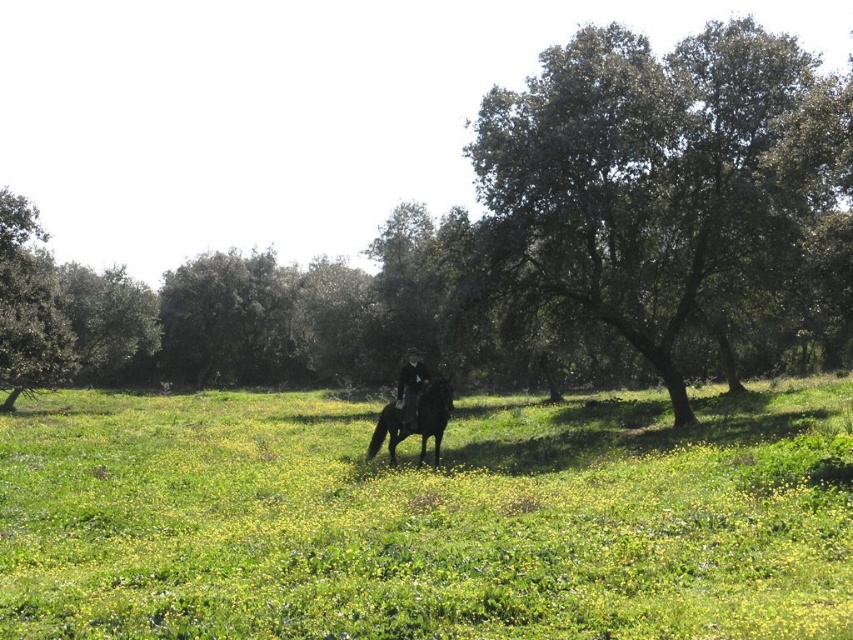
You are an archer standing in the middle of the field. You need to shoot an arrow towards the trees. Which tree would require a higher trajectory to hit? The green leafy tree at upper right or the green leafy tree at left?

The green leafy tree at upper right is bigger than the green leafy tree at left, so you would need a higher trajectory to hit the green leafy tree at upper right because it is taller.